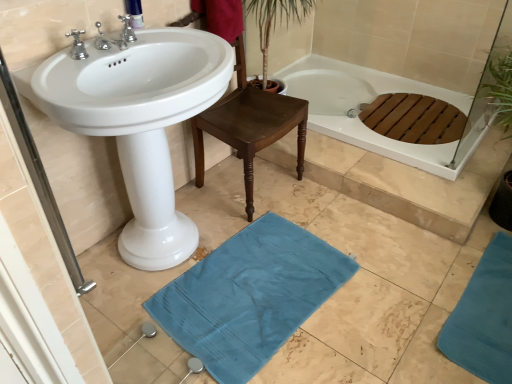
Locate an element on the screen. vacant area that lies to the right of polished chrome faucet at upper center, which ranks as the first tap in back-to-front order is located at coordinates (175, 37).